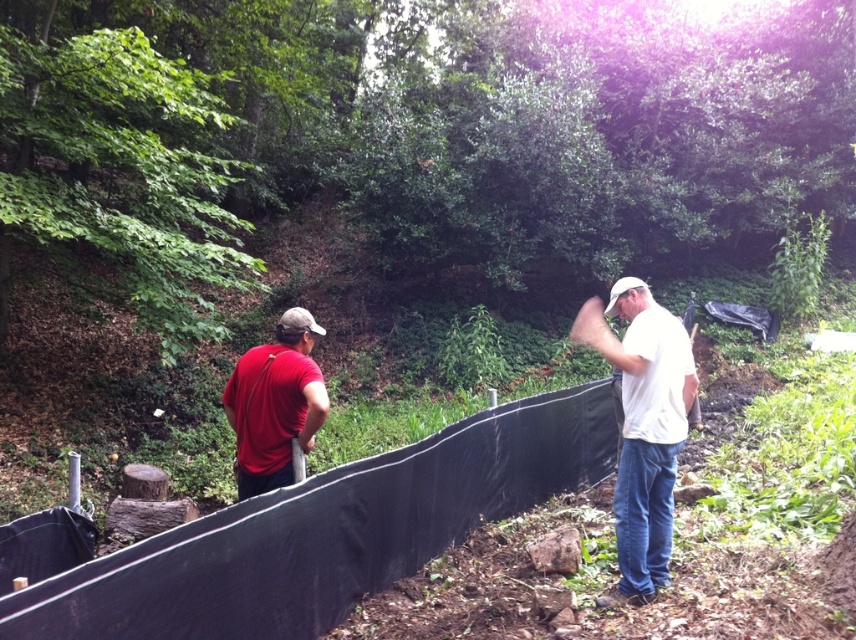
The height and width of the screenshot is (640, 856). I want to click on black plastic fence at center, so click(325, 532).

Between point (402, 449) and point (666, 364), which one is positioned in front?

Positioned in front is point (666, 364).

Find the location of `black plastic fence at center`. black plastic fence at center is located at coordinates (325, 532).

Which is in front, point (476, 433) or point (282, 474)?

Positioned in front is point (282, 474).

Does point (84, 570) come in front of point (282, 358)?

Yes, it is.

Where is `black plastic fence at center`? The width and height of the screenshot is (856, 640). black plastic fence at center is located at coordinates (325, 532).

Between point (651, 369) and point (241, 472), which one is positioned behind?

The point (241, 472) is behind.

Between white matte shirt at right and matte red shirt at left, which one appears on the left side from the viewer's perspective?

From the viewer's perspective, matte red shirt at left appears more on the left side.

Where is `white matte shirt at right`? The height and width of the screenshot is (640, 856). white matte shirt at right is located at coordinates click(642, 428).